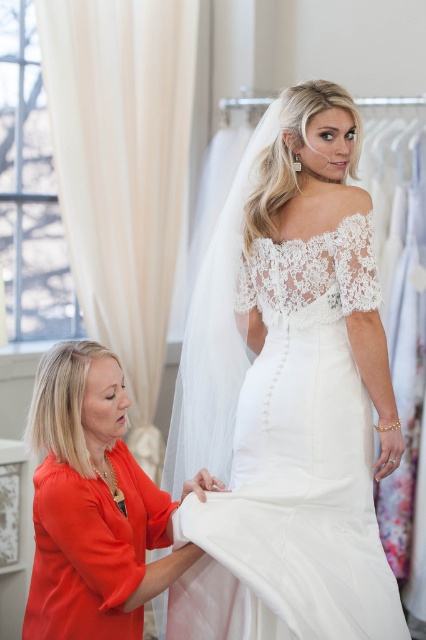
What is the location of the point with coordinates [287,396] in the bridal shop scene?

The point with coordinates [287,396] is located on the white satin dress at center.

You are a customer in the bridal shop and want to try on the white satin dress at center and the matte orange blouse at lower left. Which item is closer to the entrance if you are facing the dresses from the front of the store?

The white satin dress at center is to the right of the matte orange blouse at lower left. Since you are facing the dresses from the front of the store, the matte orange blouse at lower left is closer to the entrance as it is positioned to the left side, which is typically the entrance side in such settings.

You are a customer in the bridal shop and want to walk from the entrance to the rack of wedding dresses. The entrance is located at point A, which is point (267, 449), and the rack is at point B, point (129, 452). Based on the spatial relationship between these two points, which direction should you move to reach the rack?

Since point (267, 449) is closer to the camera than point (129, 452), you should move away from the camera to reach the rack of wedding dresses located at point (129, 452).